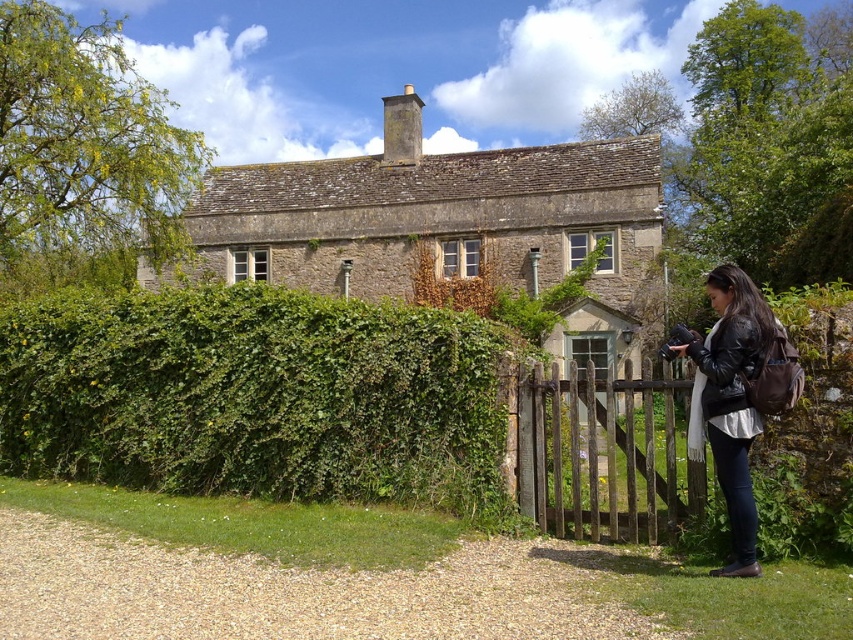
You are a visitor approaching the stone cottage at center and notice the green leafy hedge at left. Which object would you encounter first as you walk towards the cottage?

You would first encounter the green leafy hedge at left since it is closer to you than the stone cottage at center.

You are standing at the edge of the gravel path leading to the house and see the weathered wood gate at center and the black leather jacket at lower right. Which object is closer to your right side?

The black leather jacket at lower right is closer to your right side since it is positioned to the right of the weathered wood gate at center.